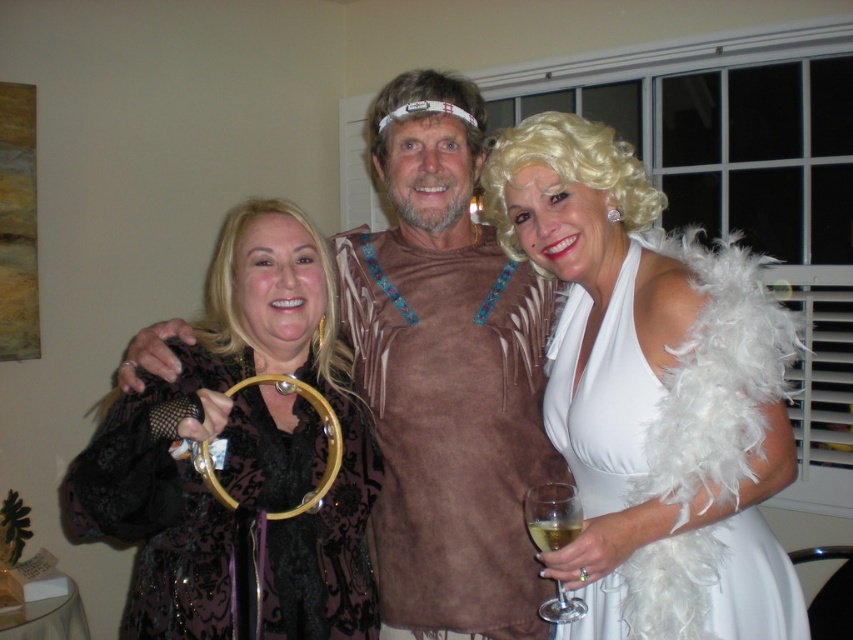
You are a photographer setting up for a group photo. You need to position a new prop, a small vase, between the blonde feather boa at right and the translucent glass at center. Based on their current positions, where should you place the vase to ensure it is between them?

The vase should be placed to the left of the blonde feather boa at right and to the right of the translucent glass at center since the blonde feather boa at right is positioned to the right of the translucent glass at center.

You are a photographer trying to capture a closeup shot of the black lace tambourine at left. Based on the scene, can you determine if the tambourine is within the recommended 40 inches focal range for your camera lens?

The black lace tambourine at left is 39.09 inches away from the camera, which is within the recommended 40 inches focal range for your camera lens.